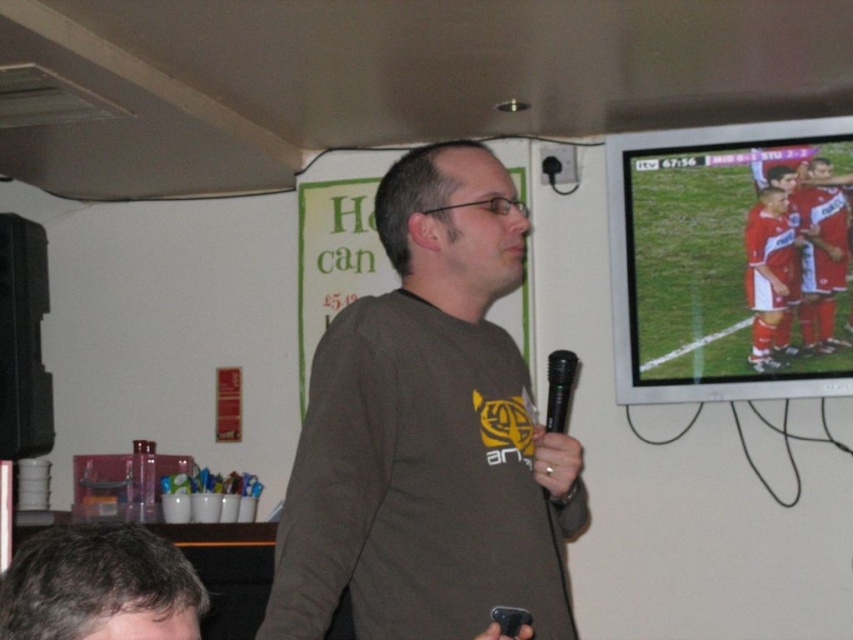
Does point (323, 573) come farther from viewer compared to point (566, 410)?

No, (323, 573) is closer to viewer.

Image resolution: width=853 pixels, height=640 pixels. What do you see at coordinates (428, 433) in the screenshot?
I see `matte brown shirt at center` at bounding box center [428, 433].

Who is more distant from viewer, (282, 545) or (556, 372)?

Point (556, 372)

The image size is (853, 640). Identify the location of matte brown shirt at center. (428, 433).

Can you confirm if dark brown hair at lower left is positioned to the left of black metallic microphone at center?

Correct, you'll find dark brown hair at lower left to the left of black metallic microphone at center.

Locate an element on the screen. The height and width of the screenshot is (640, 853). dark brown hair at lower left is located at coordinates (100, 586).

Can you confirm if red fabric soccer players at upper right is bigger than black metallic microphone at center?

Correct, red fabric soccer players at upper right is larger in size than black metallic microphone at center.

Measure the distance between point (828, 180) and camera.

The distance of point (828, 180) from camera is 8.14 feet.

Which is behind, point (740, 228) or point (566, 371)?

The point (740, 228) is more distant.

Locate an element on the screen. red fabric soccer players at upper right is located at coordinates (732, 260).